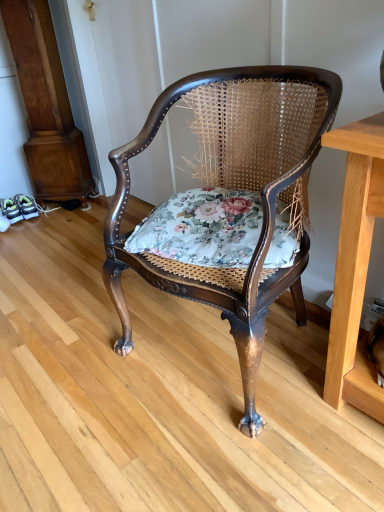
Locate an element on the screen. free point below polished wood chair at center (from a real-world perspective) is located at coordinates (216, 346).